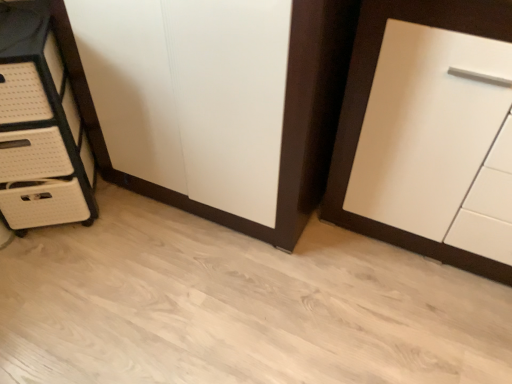
The width and height of the screenshot is (512, 384). What do you see at coordinates (39, 127) in the screenshot?
I see `white woven chest of drawers at left` at bounding box center [39, 127].

Locate an element on the screen. The image size is (512, 384). white woven chest of drawers at left is located at coordinates coord(39,127).

Consider the image. In order to face white woven chest of drawers at left, should I rotate leftwards or rightwards?

Turn left approximately 27.724 degrees to face it.

Measure the distance between point (55, 163) and camera.

Point (55, 163) and camera are 1.37 meters apart.

This screenshot has width=512, height=384. Describe the element at coordinates (366, 107) in the screenshot. I see `white matte cupboard at right` at that location.

The height and width of the screenshot is (384, 512). What are the coordinates of `white matte cupboard at right` in the screenshot? It's located at (366, 107).

Locate an element on the screen. The height and width of the screenshot is (384, 512). white woven chest of drawers at left is located at coordinates (39, 127).

Considering the relative positions of white matte cupboard at right and white woven chest of drawers at left in the image provided, is white matte cupboard at right to the right of white woven chest of drawers at left from the viewer's perspective?

Indeed, white matte cupboard at right is positioned on the right side of white woven chest of drawers at left.

Between white matte cupboard at right and white woven chest of drawers at left, which one is positioned in front?

white matte cupboard at right is more forward.

Does point (362, 20) come in front of point (49, 82)?

Yes, it is.

From the image's perspective, is white matte cupboard at right above or below white woven chest of drawers at left?

Clearly, from the image's perspective, white matte cupboard at right is below white woven chest of drawers at left.

From a real-world perspective, is white matte cupboard at right on white woven chest of drawers at left?

Yes.

Considering the sizes of objects white matte cupboard at right and white woven chest of drawers at left in the image provided, who is wider, white matte cupboard at right or white woven chest of drawers at left?

Wider between the two is white matte cupboard at right.

In terms of height, does white matte cupboard at right look taller or shorter compared to white woven chest of drawers at left?

white matte cupboard at right is taller than white woven chest of drawers at left.

Which of these two, white matte cupboard at right or white woven chest of drawers at left, is bigger?

white matte cupboard at right is bigger.

Is white matte cupboard at right inside or outside of white woven chest of drawers at left?

white matte cupboard at right lies outside white woven chest of drawers at left.

Are white matte cupboard at right and white woven chest of drawers at left far apart?

Actually, white matte cupboard at right and white woven chest of drawers at left are a little close together.

Is white matte cupboard at right looking in the opposite direction of white woven chest of drawers at left?

white matte cupboard at right is not turned away from white woven chest of drawers at left.

Measure the distance between white matte cupboard at right and white woven chest of drawers at left.

white matte cupboard at right is 97.64 centimeters from white woven chest of drawers at left.

You are a GUI agent. You are given a task and a screenshot of the screen. Output one action in this format:
    pyautogui.click(x=<x>, y=<y>)
    Task: Click on the cupboard above the white woven chest of drawers at left (from a real-world perspective)
    
    Given the screenshot: What is the action you would take?
    pyautogui.click(x=366, y=107)

Is white woven chest of drawers at left to the left or to the right of white matte cupboard at right in the image?

white woven chest of drawers at left is to the left of white matte cupboard at right.

From the picture: Is the depth of white woven chest of drawers at left less than that of white matte cupboard at right?

That is False.

Considering the positions of points (24, 154) and (477, 269), is point (24, 154) farther from camera compared to point (477, 269)?

That is False.

Looking at this image, from the image's perspective, which is above, white woven chest of drawers at left or white matte cupboard at right?

white woven chest of drawers at left appears higher in the image.

Consider the image. From a real-world perspective, relative to white matte cupboard at right, is white woven chest of drawers at left vertically above or below?

white woven chest of drawers at left is below white matte cupboard at right.

Which object is thinner, white woven chest of drawers at left or white matte cupboard at right?

With smaller width is white woven chest of drawers at left.

Is white woven chest of drawers at left shorter than white matte cupboard at right?

Indeed, white woven chest of drawers at left has a lesser height compared to white matte cupboard at right.

Does white woven chest of drawers at left have a larger size compared to white matte cupboard at right?

No.

Is white woven chest of drawers at left located outside white matte cupboard at right?

Yes, white woven chest of drawers at left is not within white matte cupboard at right.

Is white woven chest of drawers at left next to white matte cupboard at right?

No.

Is white woven chest of drawers at left turned away from white matte cupboard at right?

white woven chest of drawers at left does not have its back to white matte cupboard at right.

In the image, there is a white matte cupboard at right. Identify the location of the chest of drawers above it (from the image's perspective). The width and height of the screenshot is (512, 384). (39, 127).

This screenshot has width=512, height=384. I want to click on the chest of drawers located behind the white matte cupboard at right, so click(39, 127).

The image size is (512, 384). Identify the location of cupboard above the white woven chest of drawers at left (from a real-world perspective). (366, 107).